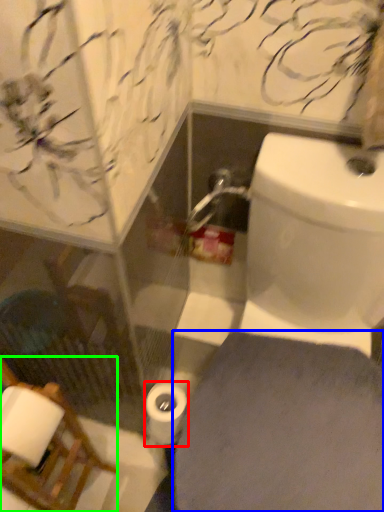
Question: Which object is positioned farthest from toilet paper (highlighted by a red box)? Select from porcelain (highlighted by a blue box) and chair (highlighted by a green box).

Choices:
 (A) porcelain
 (B) chair

Answer: (B)